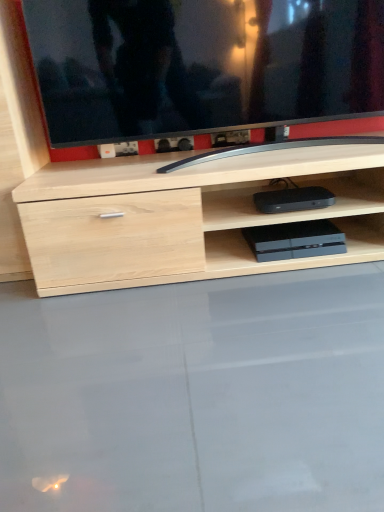
Question: Is black glossy tv at upper center positioned behind black plastic device at center, placed as the first equipment when sorted from top to bottom?

Choices:
 (A) yes
 (B) no

Answer: (B)

Question: Does black glossy tv at upper center have a greater width compared to black plastic device at center, the 2th equipment when ordered from bottom to top?

Choices:
 (A) no
 (B) yes

Answer: (B)

Question: Does black glossy tv at upper center have a greater height compared to black plastic device at center, the 2th equipment when ordered from bottom to top?

Choices:
 (A) no
 (B) yes

Answer: (B)

Question: Is black glossy tv at upper center at the left side of black plastic device at center, the 2th equipment when ordered from bottom to top?

Choices:
 (A) no
 (B) yes

Answer: (B)

Question: Are black glossy tv at upper center and black plastic device at center, placed as the first equipment when sorted from top to bottom, located far from each other?

Choices:
 (A) yes
 (B) no

Answer: (B)

Question: From a real-world perspective, relative to slate gray plastic game console at lower center, which is counted as the first equipment, starting from the bottom, is black plastic device at center, placed as the first equipment when sorted from top to bottom, vertically above or below?

Choices:
 (A) below
 (B) above

Answer: (B)

Question: Is black plastic device at center, placed as the first equipment when sorted from top to bottom, taller or shorter than slate gray plastic game console at lower center, the second equipment when ordered from top to bottom?

Choices:
 (A) tall
 (B) short

Answer: (A)

Question: Visually, is black plastic device at center, placed as the first equipment when sorted from top to bottom, positioned to the left or to the right of slate gray plastic game console at lower center, the second equipment when ordered from top to bottom?

Choices:
 (A) left
 (B) right

Answer: (A)

Question: Considering their positions, is black plastic device at center, the 2th equipment when ordered from bottom to top, located in front of or behind slate gray plastic game console at lower center, the second equipment when ordered from top to bottom?

Choices:
 (A) front
 (B) behind

Answer: (A)

Question: From their relative heights in the image, would you say black plastic device at center, the 2th equipment when ordered from bottom to top, is taller or shorter than transparent glass table at lower center?

Choices:
 (A) short
 (B) tall

Answer: (B)

Question: Do you think black plastic device at center, placed as the first equipment when sorted from top to bottom, is within transparent glass table at lower center, or outside of it?

Choices:
 (A) outside
 (B) inside

Answer: (A)

Question: Considering their positions, is black plastic device at center, placed as the first equipment when sorted from top to bottom, located in front of or behind transparent glass table at lower center?

Choices:
 (A) behind
 (B) front

Answer: (A)

Question: Considering the positions of point (309, 196) and point (117, 453), is point (309, 196) closer or farther from the camera than point (117, 453)?

Choices:
 (A) closer
 (B) farther

Answer: (B)

Question: Is transparent glass table at lower center in front of or behind slate gray plastic game console at lower center, which is counted as the first equipment, starting from the bottom, in the image?

Choices:
 (A) front
 (B) behind

Answer: (A)

Question: Is point (370, 459) closer or farther from the camera than point (301, 242)?

Choices:
 (A) closer
 (B) farther

Answer: (A)